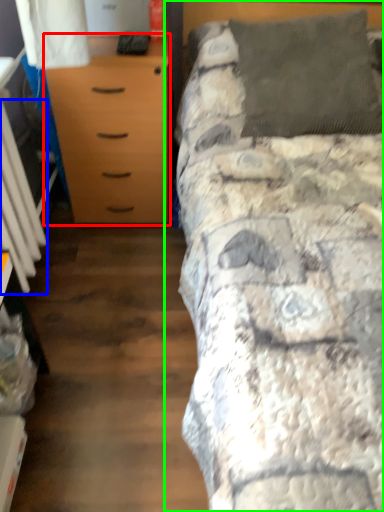
Question: Considering the real-world distances, which object is farthest from chest of drawers (highlighted by a red box)? radiator (highlighted by a blue box) or bed (highlighted by a green box)?

Choices:
 (A) radiator
 (B) bed

Answer: (B)